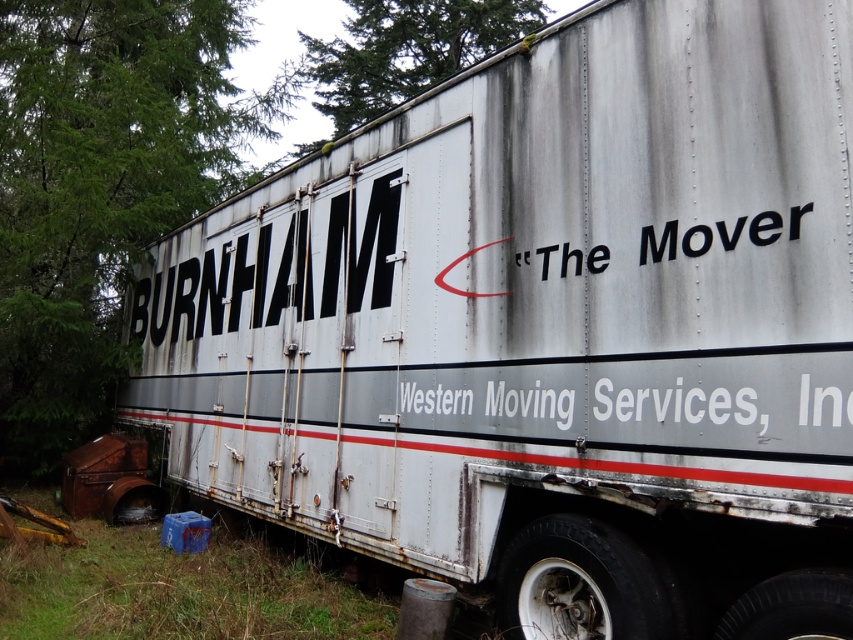
Question: Which point is closer to the camera?

Choices:
 (A) (674, 243)
 (B) (718, 410)
 (C) (132, 148)
 (D) (334, 93)

Answer: (B)

Question: Which of the following is the farthest from the observer?

Choices:
 (A) (532, 397)
 (B) (216, 150)

Answer: (B)

Question: Is green mossy tree at upper center wider than white matte text at center?

Choices:
 (A) yes
 (B) no

Answer: (A)

Question: Which object is farther from the camera taking this photo?

Choices:
 (A) green mossy tree at upper center
 (B) white matte text at center
 (C) black matte text at center
 (D) green leafy tree at upper left

Answer: (A)

Question: Does green leafy tree at upper left have a greater width compared to green mossy tree at upper center?

Choices:
 (A) no
 (B) yes

Answer: (A)

Question: Can you confirm if green leafy tree at upper left is bigger than green mossy tree at upper center?

Choices:
 (A) no
 (B) yes

Answer: (A)